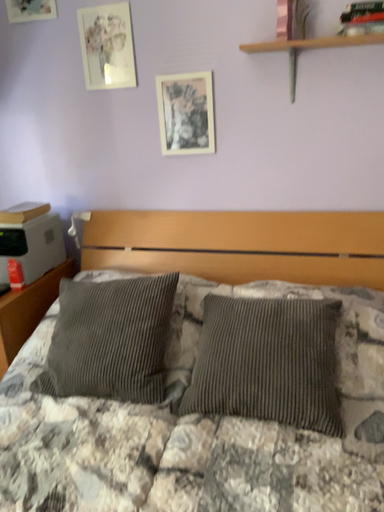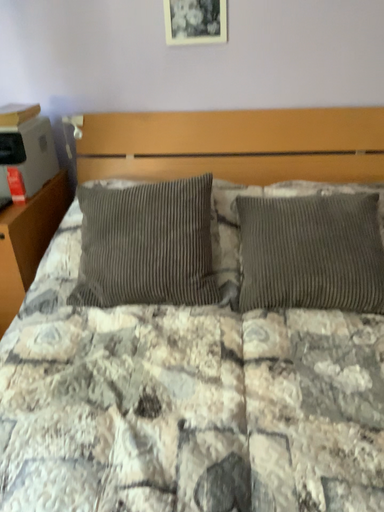
Question: Which way did the camera rotate in the video?

Choices:
 (A) rotated left
 (B) rotated right

Answer: (B)